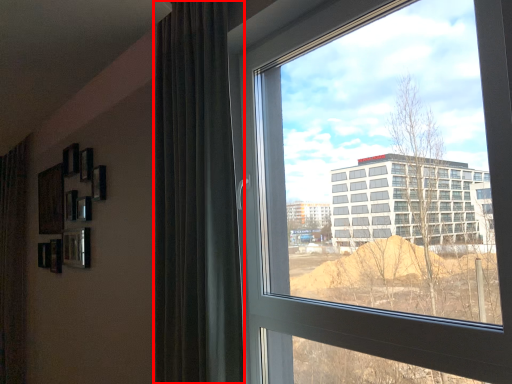
Question: Considering the relative positions of curtain (annotated by the red box) and window in the image provided, where is curtain (annotated by the red box) located with respect to the staircase?

Choices:
 (A) right
 (B) left

Answer: (B)